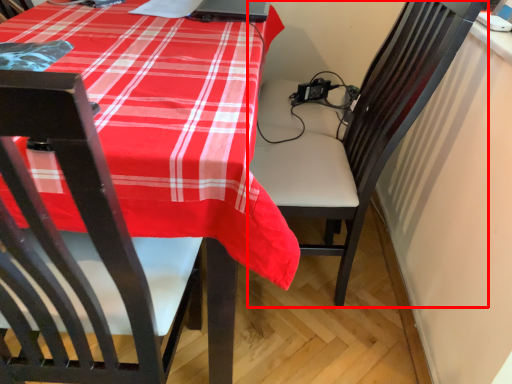
Question: From the image's perspective, what is the correct spatial positioning of chair (annotated by the red box) in reference to laptop?

Choices:
 (A) below
 (B) above

Answer: (A)